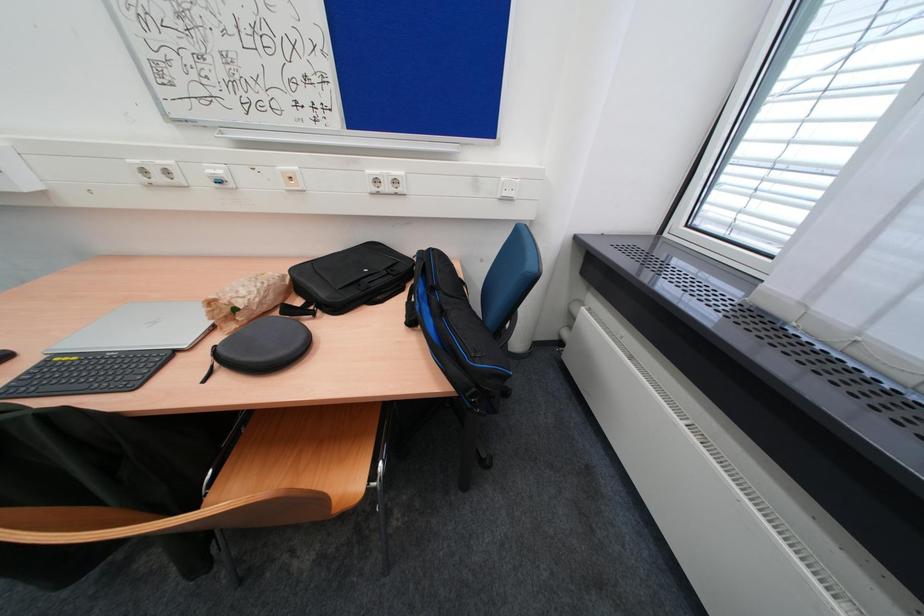
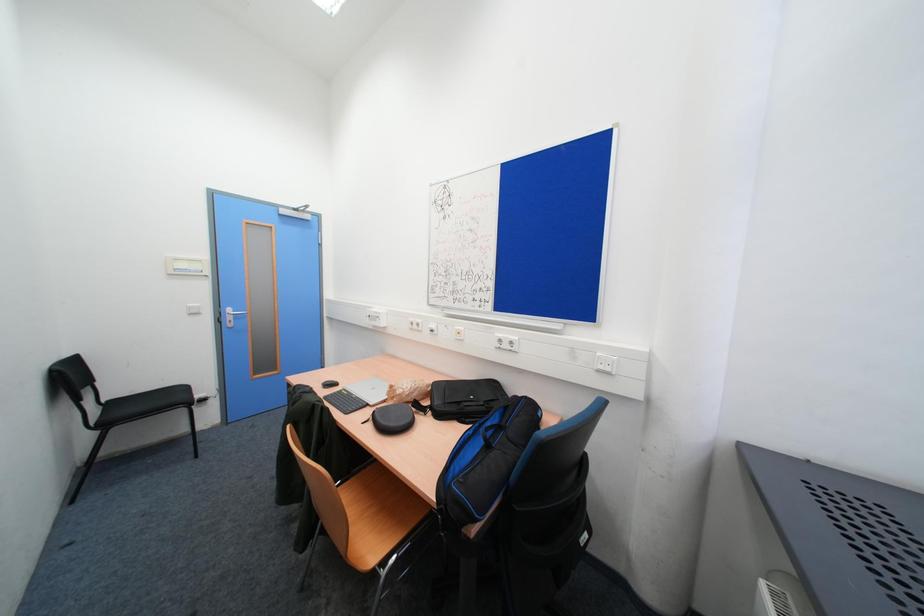
How did the camera likely rotate?

The rotation direction of the camera is left-up.